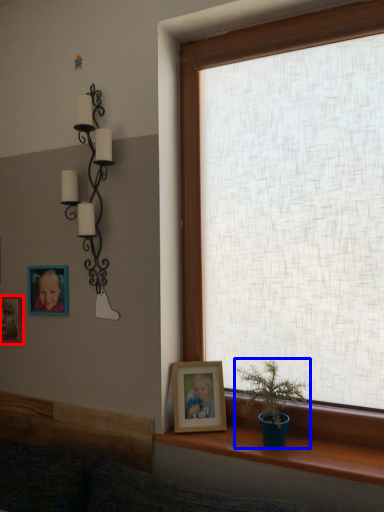
Question: Which object appears closest to the camera in this image, picture frame (highlighted by a red box) or houseplant (highlighted by a blue box)?

Choices:
 (A) picture frame
 (B) houseplant

Answer: (B)